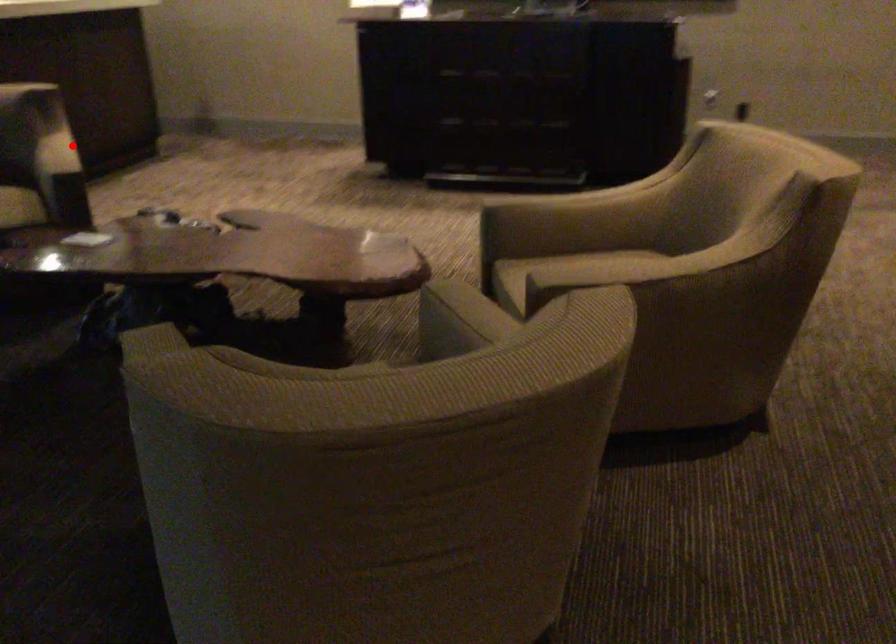
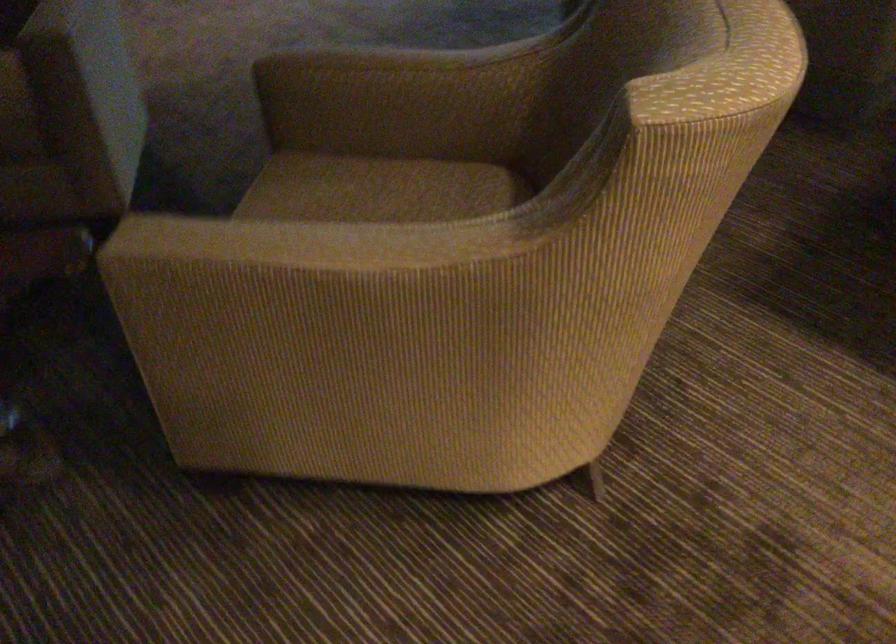
Question: I am providing you with two images of the same scene from different viewpoints. A red point is marked on the first image. Is the red point's position out of view in image 2?

Choices:
 (A) Yes
 (B) No

Answer: (B)